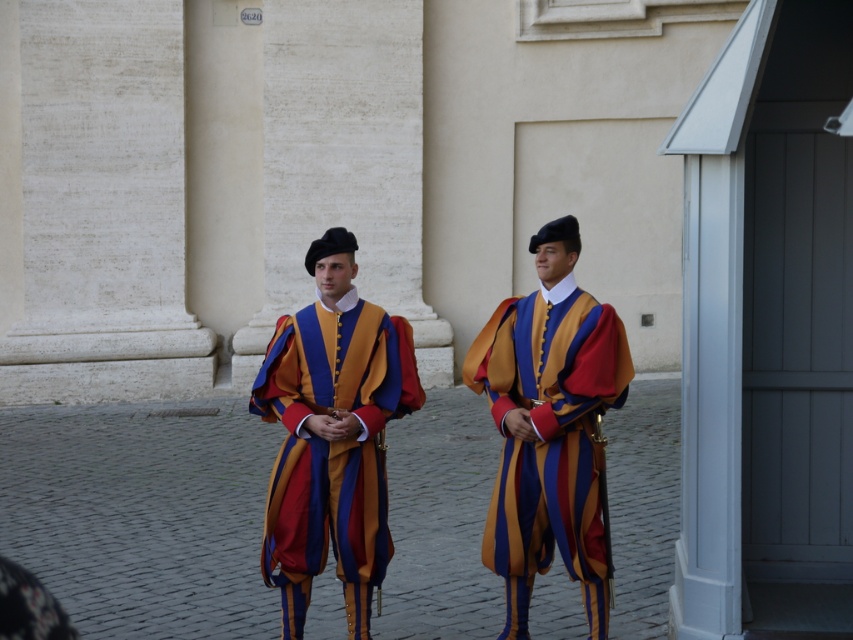
Is matte velvet uniform at center positioned before matte striped uniform at center?

No, it is behind matte striped uniform at center.

Does matte velvet uniform at center have a larger size compared to matte striped uniform at center?

Actually, matte velvet uniform at center might be smaller than matte striped uniform at center.

Find the location of a particular element. matte velvet uniform at center is located at coordinates (331, 436).